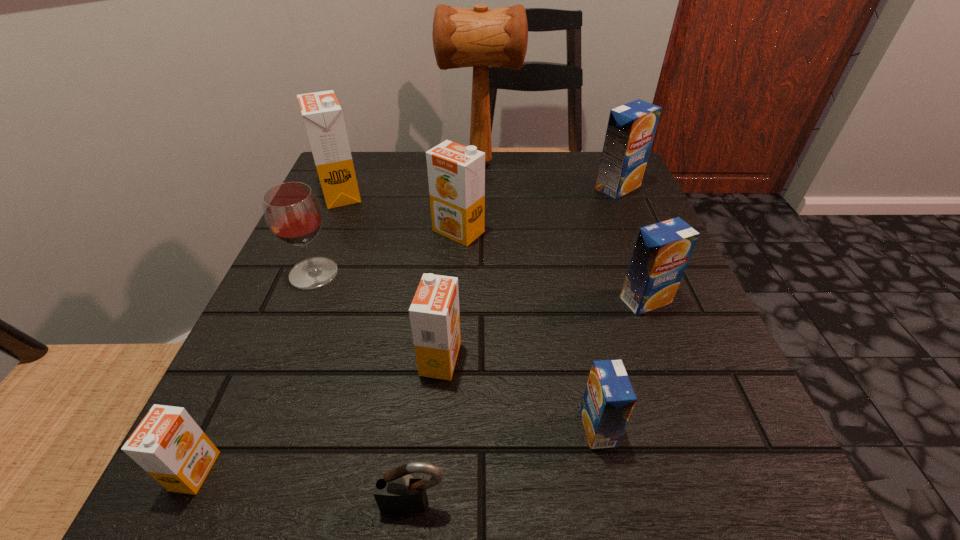
Locate an element on the screen. free region located on the front of the farthest blue orange_juice is located at coordinates pyautogui.click(x=634, y=225).

The width and height of the screenshot is (960, 540). I want to click on vacant space situated on the front of the fourth farthest object, so click(x=448, y=402).

I want to click on vacant space located on the front of the wineglass, so click(262, 399).

At what (x,y) coordinates should I click in order to perform the action: click on vacant region located on the left of the second farthest blue orange_juice. Please return your answer as a coordinate pair (x, y). Image resolution: width=960 pixels, height=540 pixels. Looking at the image, I should click on 416,300.

Identify the location of vacant area situated 0.250m on the back of the third biggest orange orange juice. (450, 238).

Image resolution: width=960 pixels, height=540 pixels. What are the coordinates of `blank space located on the left of the nearest blue orange_juice` in the screenshot? It's located at (466, 428).

The width and height of the screenshot is (960, 540). Identify the location of vacant space situated 0.210m on the back of the nearest orange orange juice. (266, 321).

Locate an element on the screen. Image resolution: width=960 pixels, height=540 pixels. mallet located in the far edge section of the desktop is located at coordinates (480, 38).

The width and height of the screenshot is (960, 540). What are the coordinates of `padlock situated at the near edge` in the screenshot? It's located at (398, 491).

This screenshot has width=960, height=540. Identify the location of wineglass that is positioned at the left edge. (292, 212).